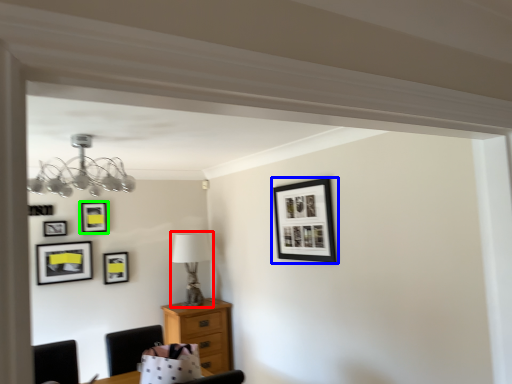
Question: Which object is the closest to the table lamp (highlighted by a red box)? Choose among these: picture frame (highlighted by a blue box) or picture frame (highlighted by a green box).

Choices:
 (A) picture frame
 (B) picture frame

Answer: (B)